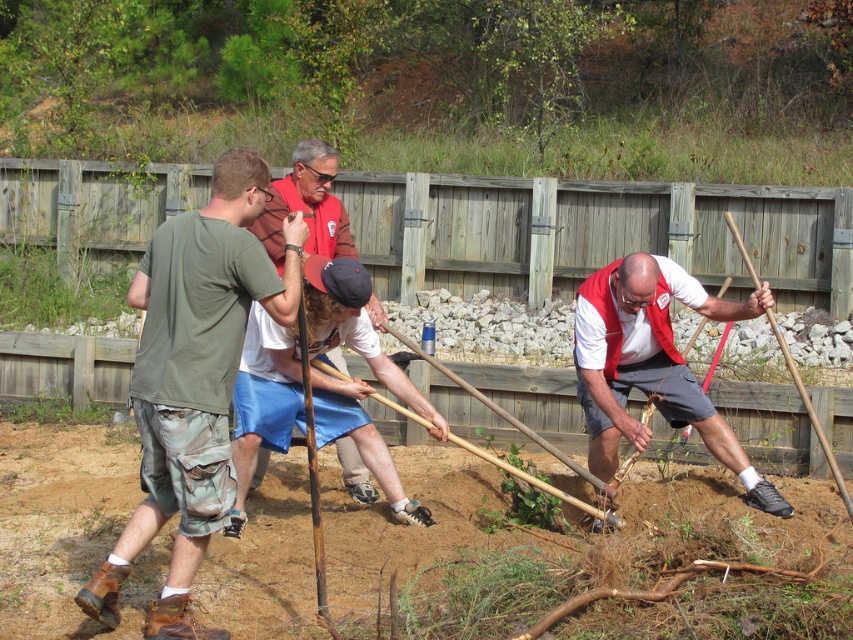
You are a photographer trying to capture a group photo of the workers. You want to ensure that both the white matte vest at center and the red shirt at center are clearly visible in the frame. Considering their sizes, which clothing item should you focus on to ensure it doesn

The white matte vest at center is wider than the red shirt at center, so focusing on the white matte vest at center would ensure it is clearly visible in the frame.

You are standing at the point marked as point (235, 256) in the garden. You want to hand a tool to someone who is 3 meters away from you. Is the person within your reach?

The distance of point (235, 256) from viewer is 5.17 meters. Since the person is 3 meters away from you, they are within your reach as 3 meters is less than 5.17 meters.